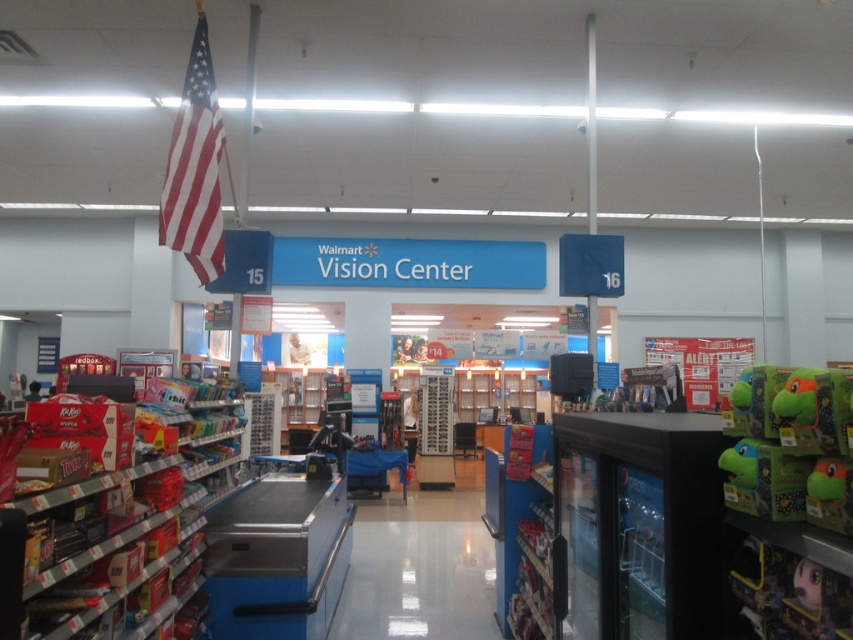
Consider the image. Does green plush toy at right come behind red-white striped flag at upper left?

No, green plush toy at right is closer to the viewer.

Which is in front, point (779, 376) or point (199, 17)?

Point (779, 376)

Locate an element on the screen. green plush toy at right is located at coordinates pyautogui.click(x=787, y=442).